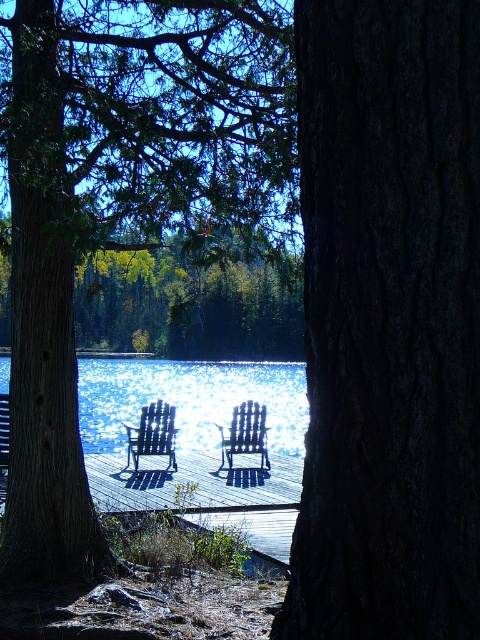
Question: Does glistening silver water at center have a greater width compared to black wood beach chair at center?

Choices:
 (A) no
 (B) yes

Answer: (B)

Question: Is glistening silver water at center closer to camera compared to black wood beach chair at center?

Choices:
 (A) no
 (B) yes

Answer: (A)

Question: Which object appears farthest from the camera in this image?

Choices:
 (A) green matte tree at center
 (B) black wood beach chair at center
 (C) wooden dock at center
 (D) dark brown textured tree trunk at center

Answer: (B)

Question: Is black wood beach chair at center closer to camera compared to blue plastic beach chair at center?

Choices:
 (A) yes
 (B) no

Answer: (A)

Question: Estimate the real-world distances between objects in this image. Which object is farther from the green matte tree at center?

Choices:
 (A) blue plastic beach chair at center
 (B) wooden dock at center
 (C) glistening silver water at center

Answer: (B)

Question: Which point is farther to the camera?

Choices:
 (A) wooden dock at center
 (B) dark brown textured tree trunk at center
 (C) brown wood tree at center

Answer: (A)